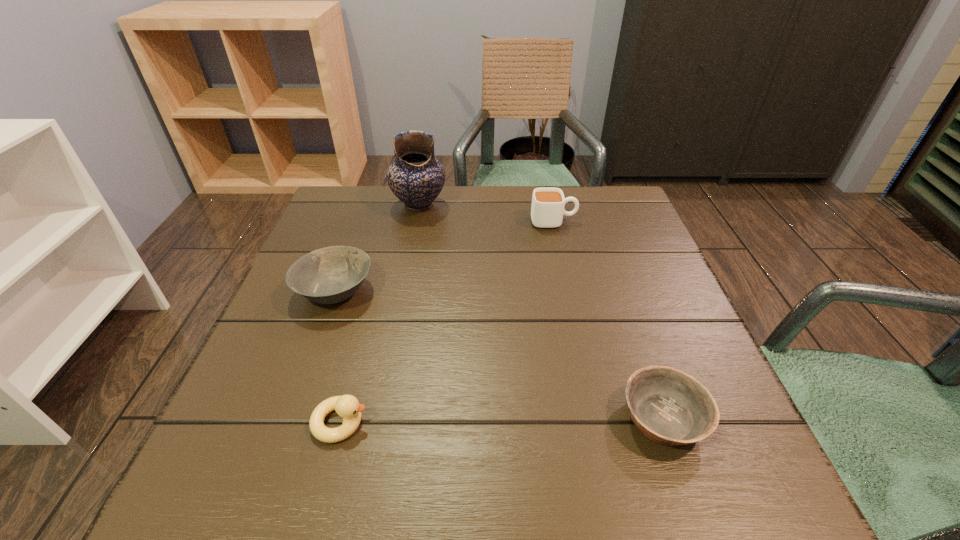
At what (x,y) coordinates should I click in order to perform the action: click on the tallest object. Please return your answer as a coordinate pair (x, y). The width and height of the screenshot is (960, 540). Looking at the image, I should click on (415, 177).

Where is `the fourth shortest object`? Image resolution: width=960 pixels, height=540 pixels. the fourth shortest object is located at coordinates (547, 209).

This screenshot has width=960, height=540. I want to click on the third nearest object, so click(330, 275).

You are a GUI agent. You are given a task and a screenshot of the screen. Output one action in this format:
    pyautogui.click(x=<x>, y=<y>)
    Task: Click on the left bowl
    
    Given the screenshot: What is the action you would take?
    pyautogui.click(x=330, y=275)

Find the location of a particular element. The width and height of the screenshot is (960, 540). duckling is located at coordinates (347, 406).

Identify the location of the shorter bowl. The height and width of the screenshot is (540, 960). (669, 407).

Where is `the shortest object`? This screenshot has height=540, width=960. the shortest object is located at coordinates (669, 407).

Identify the location of vacant space located 0.260m on the front of the pottery. The height and width of the screenshot is (540, 960). (403, 287).

Image resolution: width=960 pixels, height=540 pixels. Find the location of `vacant space located 0.080m on the side with the handle of the fourth shortest object`. vacant space located 0.080m on the side with the handle of the fourth shortest object is located at coordinates (x=607, y=221).

Where is `free spot located 0.150m on the back of the third nearest object`? The width and height of the screenshot is (960, 540). free spot located 0.150m on the back of the third nearest object is located at coordinates (357, 228).